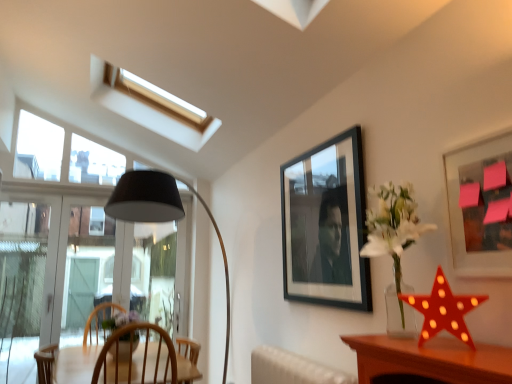
Question: Relative to black matte picture frame at upper center, arranged as the 2th picture frame when viewed from the front, is red plastic star at right in front or behind?

Choices:
 (A) behind
 (B) front

Answer: (B)

Question: From the image's perspective, relative to black matte picture frame at upper center, arranged as the 2th picture frame when viewed from the front, is red plastic star at right above or below?

Choices:
 (A) above
 (B) below

Answer: (B)

Question: Which is nearer to the transparent glass window at left?

Choices:
 (A) red plastic star at right
 (B) black matte picture frame at upper center, which is the 2th picture frame from right to left
 (C) matte black picture frame at upper right, positioned as the 1th picture frame in right-to-left order

Answer: (B)

Question: Which object is the closest to the black matte picture frame at upper center, arranged as the 2th picture frame when viewed from the front?

Choices:
 (A) matte black picture frame at upper right, positioned as the second picture frame in left-to-right order
 (B) transparent glass window at left
 (C) red plastic star at right

Answer: (A)